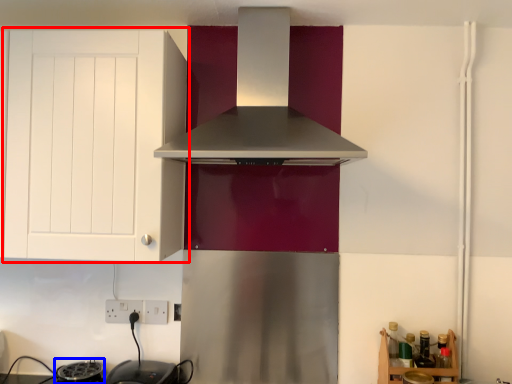
Question: Which object appears closest to the camera in this image, cabinetry (highlighted by a red box) or appliance (highlighted by a blue box)?

Choices:
 (A) cabinetry
 (B) appliance

Answer: (A)